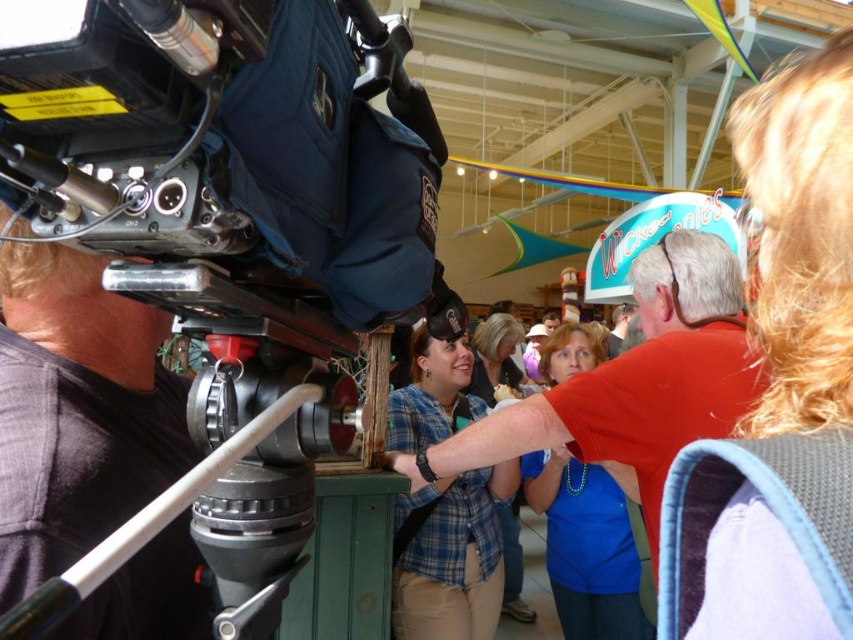
Is blue plaid shirt at center below blue fabric shirt at center?

Incorrect, blue plaid shirt at center is not positioned below blue fabric shirt at center.

Between blue plaid shirt at center and blue fabric shirt at center, which one appears on the left side from the viewer's perspective?

Positioned to the left is blue plaid shirt at center.

Is point (495, 497) less distant than point (553, 544)?

Yes, it is.

At what (x,y) coordinates should I click in order to perform the action: click on blue plaid shirt at center. Please return your answer as a coordinate pair (x, y). Looking at the image, I should click on (450, 556).

Between metallic black video camera at upper left and blue fabric shirt at center, which one is positioned lower?

blue fabric shirt at center

Between metallic black video camera at upper left and blue fabric shirt at center, which one has less height?

metallic black video camera at upper left

I want to click on metallic black video camera at upper left, so click(x=190, y=282).

Does red shirt at center have a lesser width compared to plaid shirt at center?

No, red shirt at center is not thinner than plaid shirt at center.

Looking at this image, does red shirt at center appear under plaid shirt at center?

Incorrect, red shirt at center is not positioned below plaid shirt at center.

Identify the location of red shirt at center. The image size is (853, 640). (633, 385).

I want to click on red shirt at center, so click(x=633, y=385).